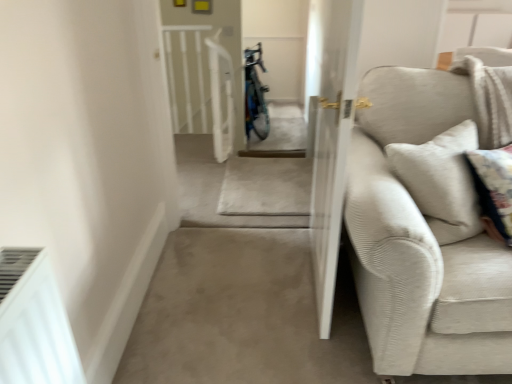
Question: Does white textured screen door at center lie in front of beige corduroy couch at right?

Choices:
 (A) no
 (B) yes

Answer: (A)

Question: Can you confirm if white textured screen door at center is bigger than beige corduroy couch at right?

Choices:
 (A) yes
 (B) no

Answer: (B)

Question: Is white textured screen door at center placed right next to beige corduroy couch at right?

Choices:
 (A) no
 (B) yes

Answer: (A)

Question: Is white textured screen door at center at the left side of beige corduroy couch at right?

Choices:
 (A) no
 (B) yes

Answer: (B)

Question: Considering the relative sizes of white textured screen door at center and beige corduroy couch at right in the image provided, is white textured screen door at center shorter than beige corduroy couch at right?

Choices:
 (A) no
 (B) yes

Answer: (A)

Question: From a real-world perspective, is white textured screen door at center on beige corduroy couch at right?

Choices:
 (A) no
 (B) yes

Answer: (B)

Question: Does beige corduroy couch at right turn towards white textured screen door at center?

Choices:
 (A) no
 (B) yes

Answer: (A)

Question: Are beige corduroy couch at right and white textured screen door at center far apart?

Choices:
 (A) no
 (B) yes

Answer: (A)

Question: Can you confirm if beige corduroy couch at right is wider than white textured screen door at center?

Choices:
 (A) no
 (B) yes

Answer: (B)

Question: Is beige corduroy couch at right taller than white textured screen door at center?

Choices:
 (A) yes
 (B) no

Answer: (B)

Question: From a real-world perspective, is beige corduroy couch at right positioned over white textured screen door at center based on gravity?

Choices:
 (A) no
 (B) yes

Answer: (A)

Question: Is beige corduroy couch at right to the left of white textured screen door at center from the viewer's perspective?

Choices:
 (A) no
 (B) yes

Answer: (A)

Question: Considering the positions of beige corduroy couch at right and white textured screen door at center in the image, is beige corduroy couch at right wider or thinner than white textured screen door at center?

Choices:
 (A) thin
 (B) wide

Answer: (B)